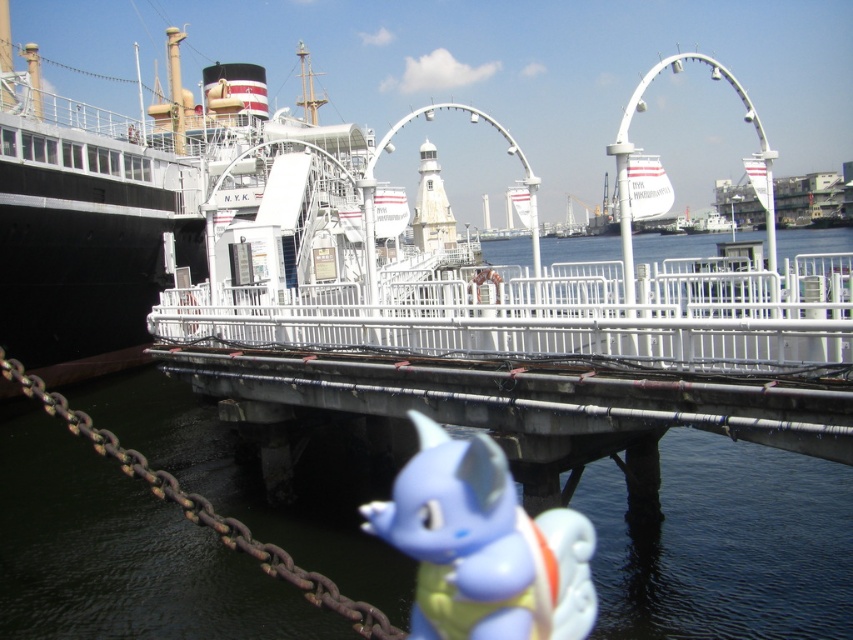
Question: Can you confirm if black polished steel cruise ship at left is bigger than blue rubber toy at lower center?

Choices:
 (A) yes
 (B) no

Answer: (A)

Question: Does white metal bridge at center have a greater width compared to blue rubber toy at lower center?

Choices:
 (A) no
 (B) yes

Answer: (B)

Question: Which point is closer to the camera?

Choices:
 (A) (254, 132)
 (B) (247, 538)
 (C) (469, 595)
 (D) (540, 390)

Answer: (B)

Question: Is white metal bridge at center positioned in front of rusty metal chain at lower left?

Choices:
 (A) no
 (B) yes

Answer: (A)

Question: Which of these objects is positioned farthest from the transparent water at center?

Choices:
 (A) rusty metal chain at lower left
 (B) white metal bridge at center

Answer: (B)

Question: Which point is closer to the camera?

Choices:
 (A) (258, 545)
 (B) (195, 534)
 (C) (544, 392)
 (D) (250, 147)

Answer: (A)